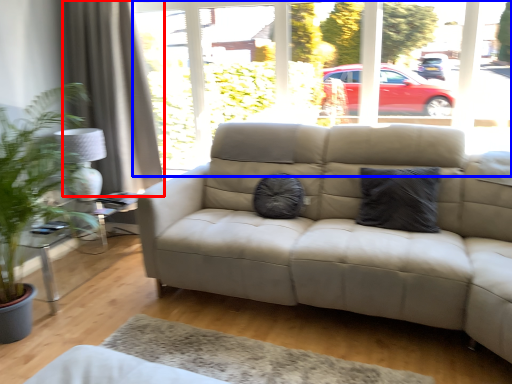
Question: Among these objects, which one is nearest to the camera, curtain (highlighted by a red box) or window frame (highlighted by a blue box)?

Choices:
 (A) curtain
 (B) window frame

Answer: (B)